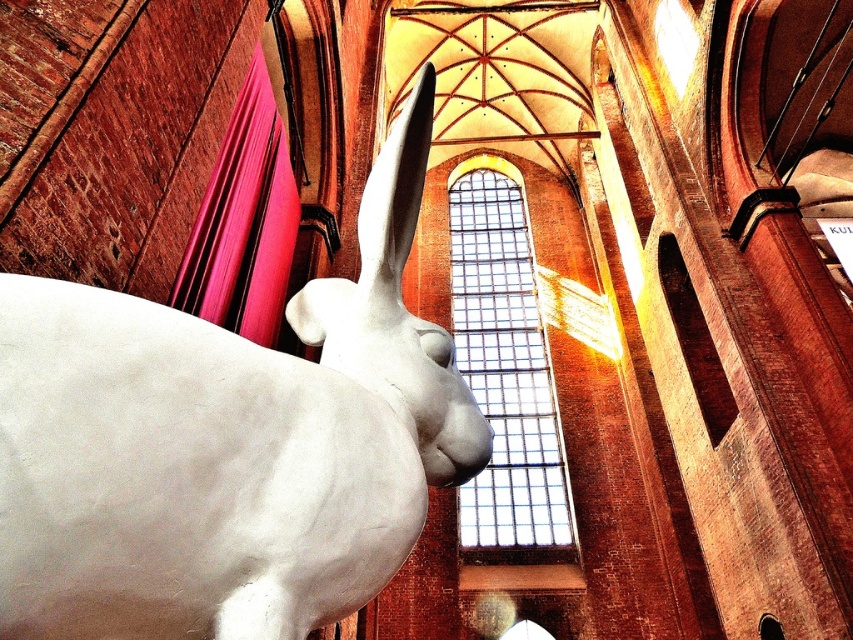
Is white glossy sculpture at left to the left of clear glass window at center from the viewer's perspective?

Correct, you'll find white glossy sculpture at left to the left of clear glass window at center.

Is white glossy sculpture at left behind clear glass window at center?

No.

Which is behind, point (461, 381) or point (569, 500)?

The point (569, 500) is more distant.

Find the location of a particular element. The width and height of the screenshot is (853, 640). white glossy sculpture at left is located at coordinates (225, 444).

Can you confirm if white glossy sculpture at left is taller than matte pink fabric at left?

Yes.

Which is below, white glossy sculpture at left or matte pink fabric at left?

white glossy sculpture at left is lower down.

Find the location of a particular element. Image resolution: width=853 pixels, height=640 pixels. white glossy sculpture at left is located at coordinates (225, 444).

Find the location of a particular element. This screenshot has height=640, width=853. white glossy sculpture at left is located at coordinates (225, 444).

Who is lower down, clear glass window at center or matte pink fabric at left?

clear glass window at center is below.

You are a GUI agent. You are given a task and a screenshot of the screen. Output one action in this format:
    pyautogui.click(x=<x>, y=<y>)
    Task: Click on the clear glass window at center
    The height and width of the screenshot is (640, 853).
    Given the screenshot: What is the action you would take?
    pyautogui.click(x=505, y=372)

Does point (538, 326) lie in front of point (265, 316)?

No, it is not.

At what (x,y) coordinates should I click in order to perform the action: click on clear glass window at center. Please return your answer as a coordinate pair (x, y). Image resolution: width=853 pixels, height=640 pixels. Looking at the image, I should click on (505, 372).